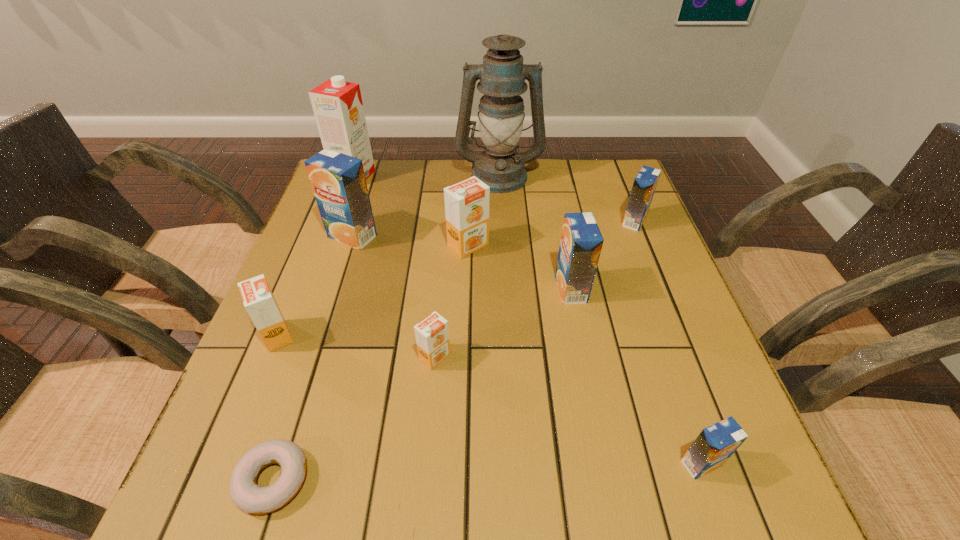
I want to click on the tallest object, so [x=502, y=76].

Locate an element on the screen. the ninth shortest object is located at coordinates (338, 108).

At what (x,y) coordinates should I click in order to perform the action: click on the tallest orange_juice. Please return your answer as a coordinate pair (x, y). Image resolution: width=960 pixels, height=540 pixels. Looking at the image, I should click on tap(338, 181).

Locate an element on the screen. Image resolution: width=960 pixels, height=540 pixels. the eighth shortest object is located at coordinates (338, 181).

Locate an element on the screen. the third blue orange_juice from right to left is located at coordinates (581, 242).

You are a GUI agent. You are given a task and a screenshot of the screen. Output one action in this format:
    pyautogui.click(x=<x>, y=<y>)
    Task: Click on the second biggest blue orange_juice
    The width and height of the screenshot is (960, 540).
    Given the screenshot: What is the action you would take?
    pyautogui.click(x=581, y=242)

This screenshot has height=540, width=960. What are the coordinates of `the farthest orange orange juice` in the screenshot? It's located at (x=467, y=202).

At what (x,y) coordinates should I click in order to perform the action: click on the third biggest blue orange_juice. Please return your answer as a coordinate pair (x, y). Looking at the image, I should click on (645, 182).

Locate an element on the screen. the second smallest orange orange juice is located at coordinates (258, 299).

What are the coordinates of `the smallest orange orange juice` in the screenshot? It's located at (432, 335).